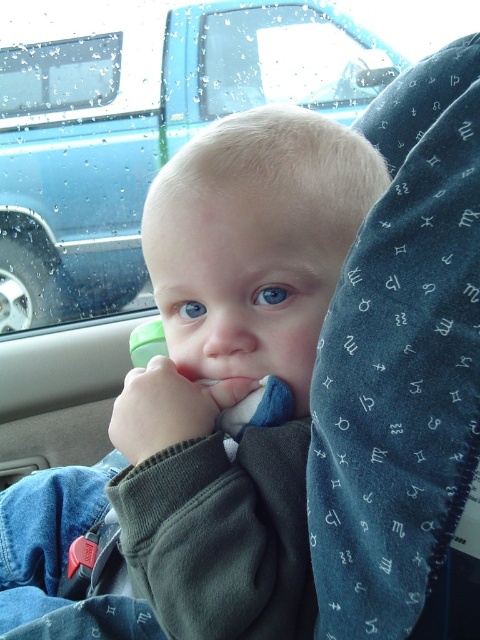
Question: Can you confirm if blue fabric car at upper center is bigger than transparent glass window at upper center?

Choices:
 (A) yes
 (B) no

Answer: (A)

Question: Based on their relative distances, which object is nearer to the transparent glass window at upper left?

Choices:
 (A) smooth green sippy cup at center
 (B) transparent glass window at upper center

Answer: (B)

Question: Considering the real-world distances, which object is farthest from the transparent glass window at upper center?

Choices:
 (A) transparent glass window at upper left
 (B) blue fabric car at upper center

Answer: (A)

Question: Can you confirm if smooth green sippy cup at center is thinner than transparent glass window at upper center?

Choices:
 (A) yes
 (B) no

Answer: (A)

Question: Which point is farther to the camera?

Choices:
 (A) (196, 548)
 (B) (322, 48)

Answer: (B)

Question: Where is transparent glass window at upper center located in relation to transparent glass window at upper left in the image?

Choices:
 (A) left
 (B) right

Answer: (B)